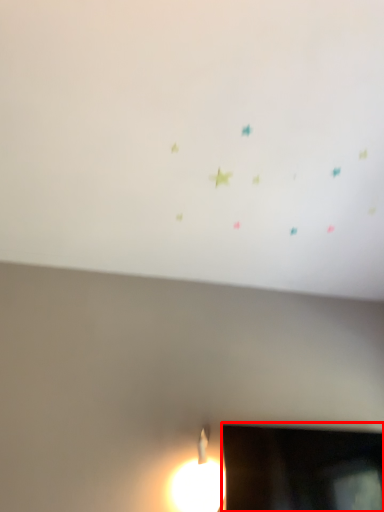
Question: From the image's perspective, what is the correct spatial relationship of television (annotated by the red box) in relation to backdrop?

Choices:
 (A) above
 (B) below

Answer: (B)